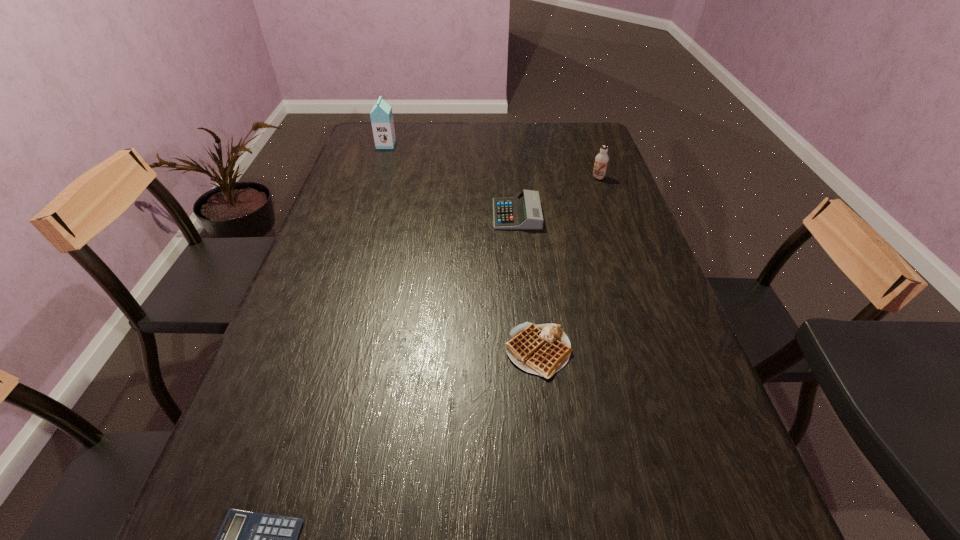
Where is `vacant space located on the left of the taller calculator`? The width and height of the screenshot is (960, 540). vacant space located on the left of the taller calculator is located at coordinates click(x=463, y=214).

You are a GUI agent. You are given a task and a screenshot of the screen. Output one action in this format:
    pyautogui.click(x=<x>, y=<y>)
    Task: Click on the vacant area situated 0.300m on the back of the fourth tallest object
    
    Given the screenshot: What is the action you would take?
    pyautogui.click(x=525, y=241)

Where is `object present at the far edge`? This screenshot has height=540, width=960. object present at the far edge is located at coordinates (381, 116).

Locate an element on the screen. The image size is (960, 540). object that is at the left edge is located at coordinates (381, 116).

The height and width of the screenshot is (540, 960). Find the location of `object present at the right edge`. object present at the right edge is located at coordinates (601, 160).

The height and width of the screenshot is (540, 960). I want to click on object present at the far left corner, so click(x=381, y=116).

At what (x,y) coordinates should I click in order to perform the action: click on free space at the far edge of the desktop. Please return your answer as a coordinate pair (x, y). Looking at the image, I should click on (501, 141).

Find the location of a particular element. vacant space at the left edge is located at coordinates (213, 505).

Identify the location of free spot at the right edge of the desktop. (588, 249).

Locate an element on the screen. The height and width of the screenshot is (540, 960). vacant space at the far left corner of the desktop is located at coordinates (368, 152).